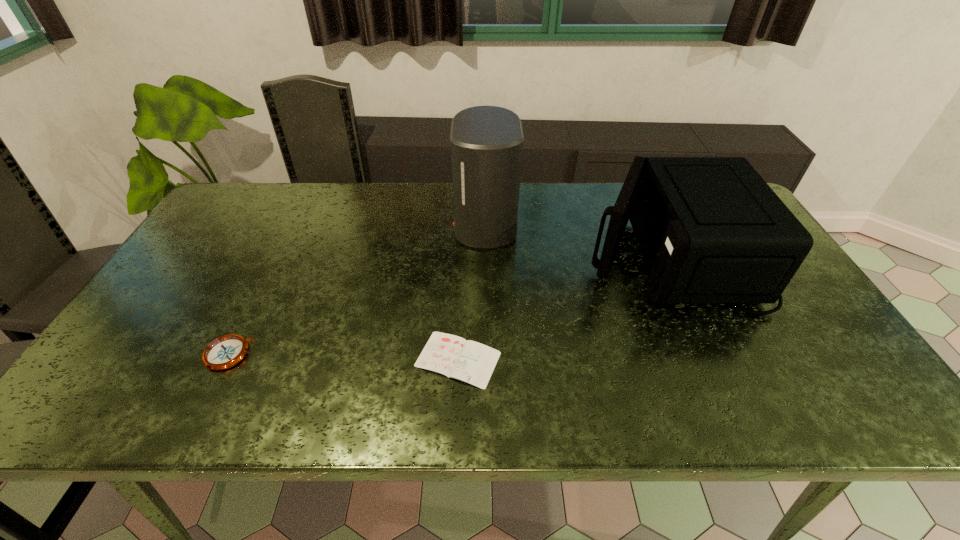
At what (x,y) coordinates should I click in order to perform the action: click on vacant space at the near edge of the desktop. Please return your answer as a coordinate pair (x, y). Looking at the image, I should click on (675, 388).

In the image, there is a desktop. Where is `vacant space at the left edge`? vacant space at the left edge is located at coordinates (138, 320).

This screenshot has width=960, height=540. I want to click on free space at the right edge, so click(x=779, y=312).

This screenshot has width=960, height=540. I want to click on free spot between the microwave oven and the second shortest object, so click(x=448, y=304).

Where is `vacant area that lies between the second tallest object and the diary`? The image size is (960, 540). vacant area that lies between the second tallest object and the diary is located at coordinates (563, 306).

The width and height of the screenshot is (960, 540). I want to click on vacant space that is in between the diary and the second tallest object, so click(x=563, y=306).

The image size is (960, 540). I want to click on vacant space that is in between the tallest object and the rightmost object, so click(577, 239).

Locate an element on the screen. unoccupied area between the diary and the third tallest object is located at coordinates (343, 357).

Identify the location of unoccupied area between the second tallest object and the second shortest object. The height and width of the screenshot is (540, 960). (448, 304).

This screenshot has width=960, height=540. Identify the location of vacant area that lies between the compass and the rightmost object. (448, 304).